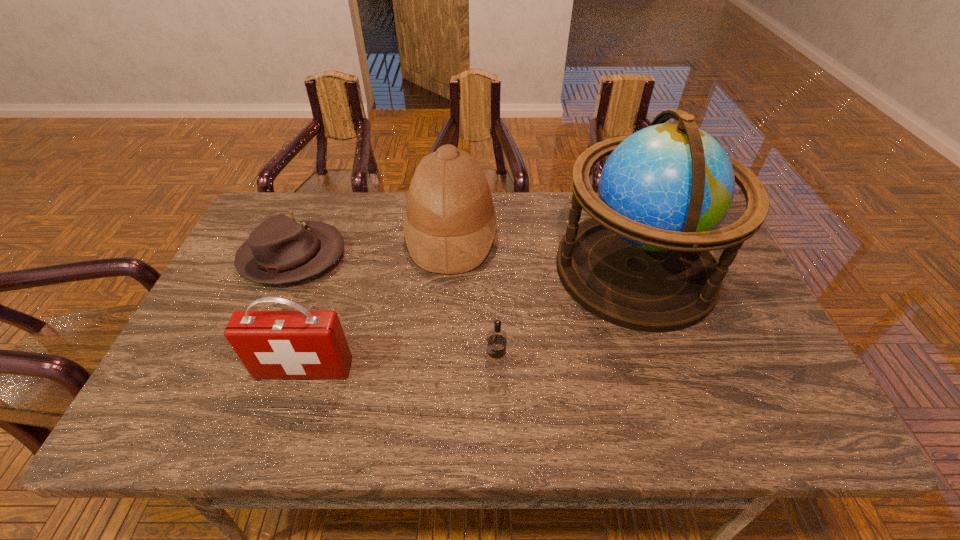
You are a GUI agent. You are given a task and a screenshot of the screen. Output one action in this format:
    pyautogui.click(x=<x>, y=<y>)
    Task: Click on the third closest object to the taller hat
    The height and width of the screenshot is (540, 960).
    Given the screenshot: What is the action you would take?
    pyautogui.click(x=495, y=363)

Select which object appears as the closest to the right hat. Please provide its 2D coordinates. Your answer should be formatted as a tuple, i.e. [(x, y)], where the tuple contains the x and y coordinates of a point satisfying the conditions above.

[(280, 250)]

You are a GUI agent. You are given a task and a screenshot of the screen. Output one action in this format:
    pyautogui.click(x=<x>, y=<y>)
    Task: Click on the blank space that satisfies the following two spatial constraints: 1. on the decorative side of the left hat; 2. on the back side of the rightmost object
    The width and height of the screenshot is (960, 540).
    Given the screenshot: What is the action you would take?
    pyautogui.click(x=288, y=269)

Where is `free region that satisfies the following two spatial constraints: 1. on the front-facing side of the globe; 2. on the left side of the taller hat`? The height and width of the screenshot is (540, 960). free region that satisfies the following two spatial constraints: 1. on the front-facing side of the globe; 2. on the left side of the taller hat is located at coordinates (449, 269).

This screenshot has width=960, height=540. Find the location of `free space that satisfies the following two spatial constraints: 1. on the front-facing side of the right hat; 2. on the back side of the tallest object`. free space that satisfies the following two spatial constraints: 1. on the front-facing side of the right hat; 2. on the back side of the tallest object is located at coordinates (449, 269).

The width and height of the screenshot is (960, 540). I want to click on vacant point that satisfies the following two spatial constraints: 1. on the front-facing side of the right hat; 2. on the front face of the first-aid kit, so click(443, 369).

Where is `free spot that satisfies the following two spatial constraints: 1. on the decorative side of the rightmost object; 2. on the left side of the left hat`? free spot that satisfies the following two spatial constraints: 1. on the decorative side of the rightmost object; 2. on the left side of the left hat is located at coordinates (288, 269).

I want to click on free space that satisfies the following two spatial constraints: 1. on the front-facing side of the right hat; 2. on the back side of the tallest object, so click(x=449, y=269).

This screenshot has width=960, height=540. I want to click on free space that satisfies the following two spatial constraints: 1. on the front-facing side of the right hat; 2. on the left side of the rightmost object, so 449,269.